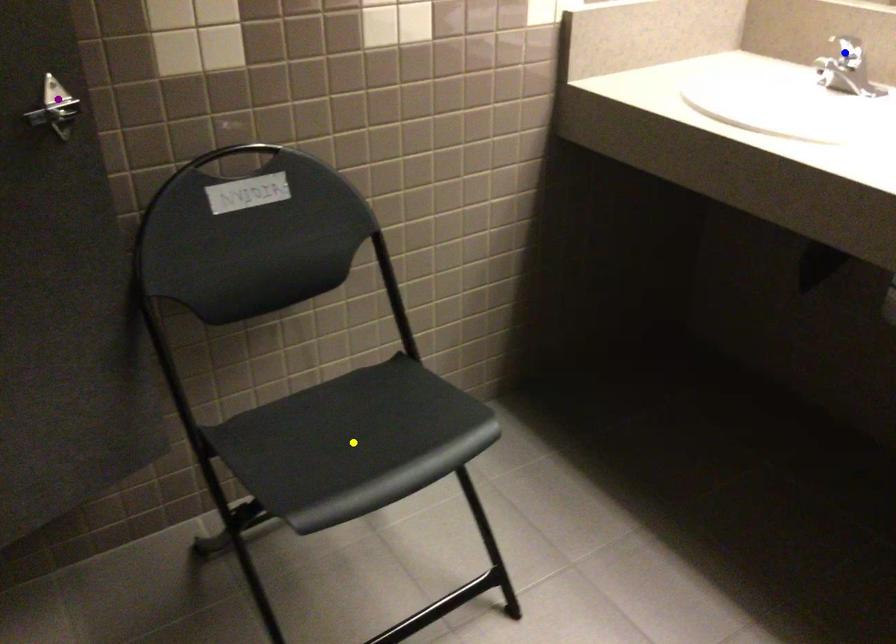
Order these from nearest to farthest:
A) yellow point
B) blue point
C) purple point

purple point
yellow point
blue point